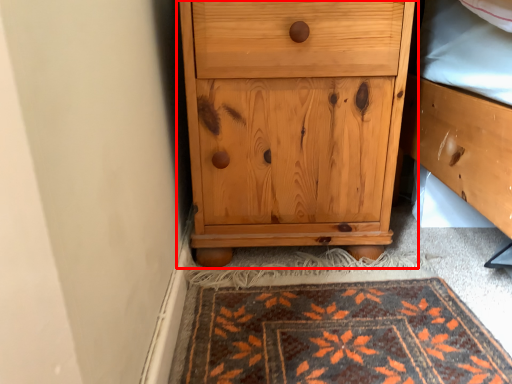
Question: In this image, where is chest of drawers (annotated by the red box) located relative to mat?

Choices:
 (A) left
 (B) right

Answer: (A)